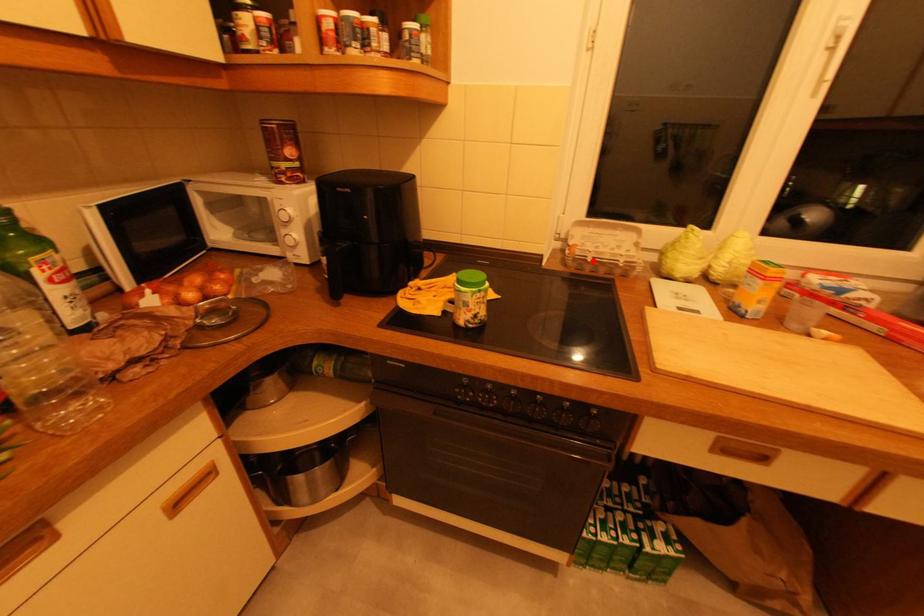
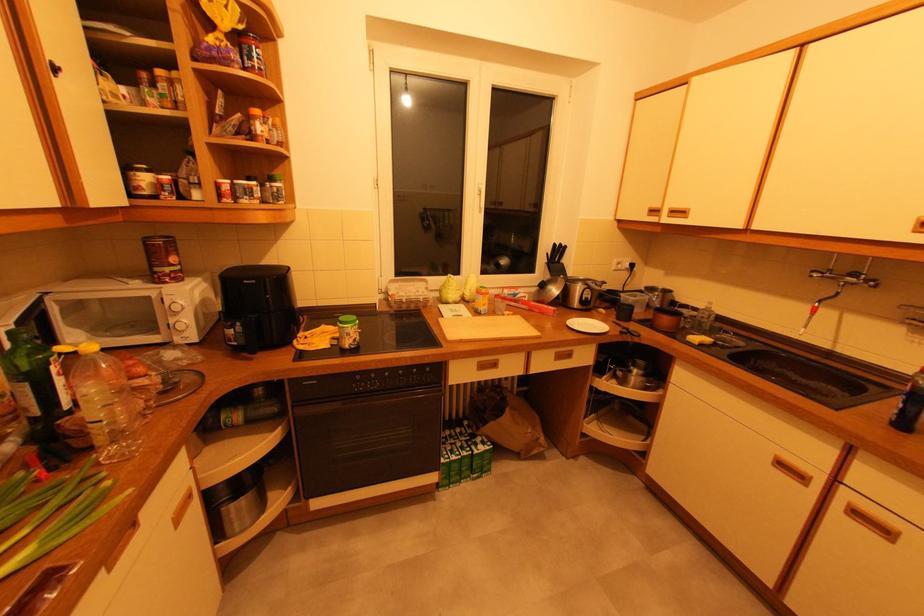
Find the pixel in the second image that matches the highlighted location in the first image.

(407, 302)